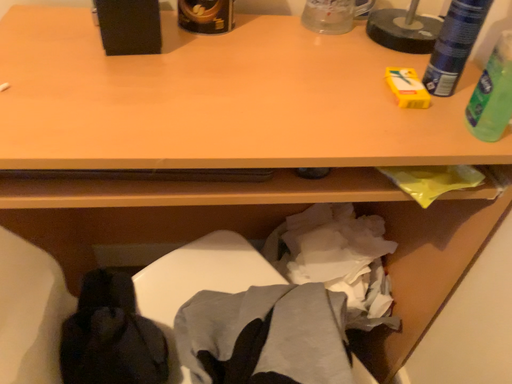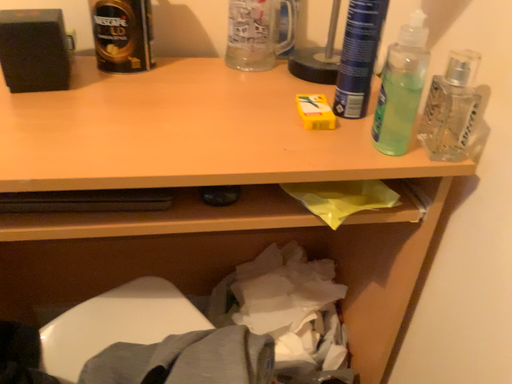
Question: How did the camera likely rotate when shooting the video?

Choices:
 (A) rotated downward
 (B) rotated upward

Answer: (B)